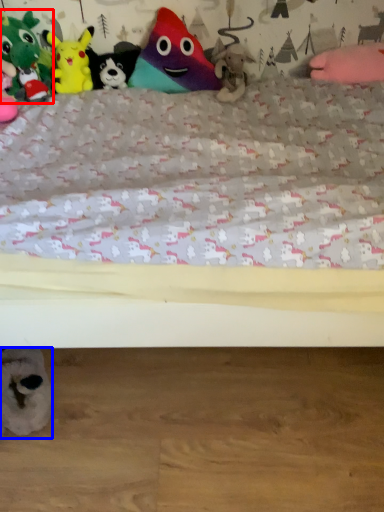
Question: Which of the following is the farthest to the observer, toy (highlighted by a red box) or toy (highlighted by a blue box)?

Choices:
 (A) toy
 (B) toy

Answer: (A)